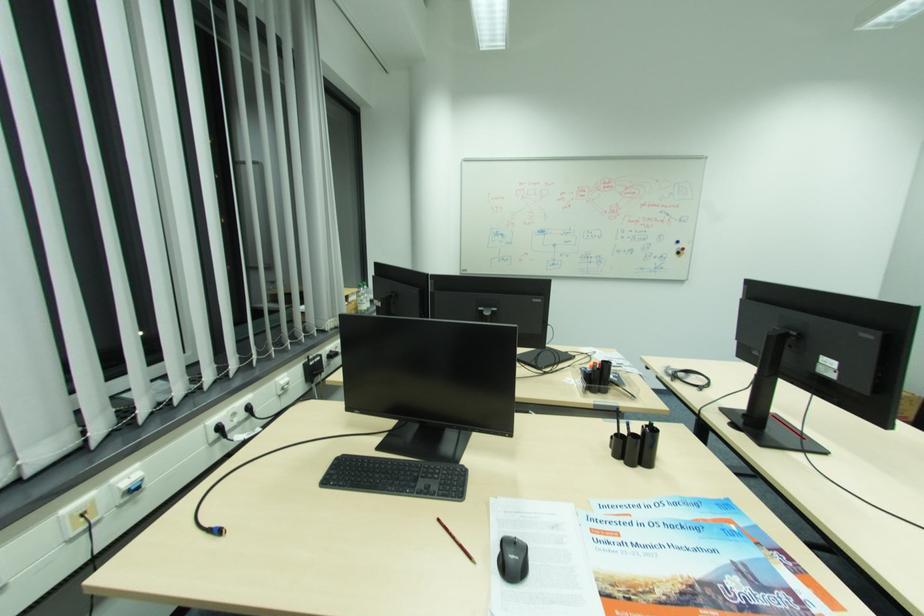
What do you see at coordinates (129, 485) in the screenshot? I see `a blue rocker switch` at bounding box center [129, 485].